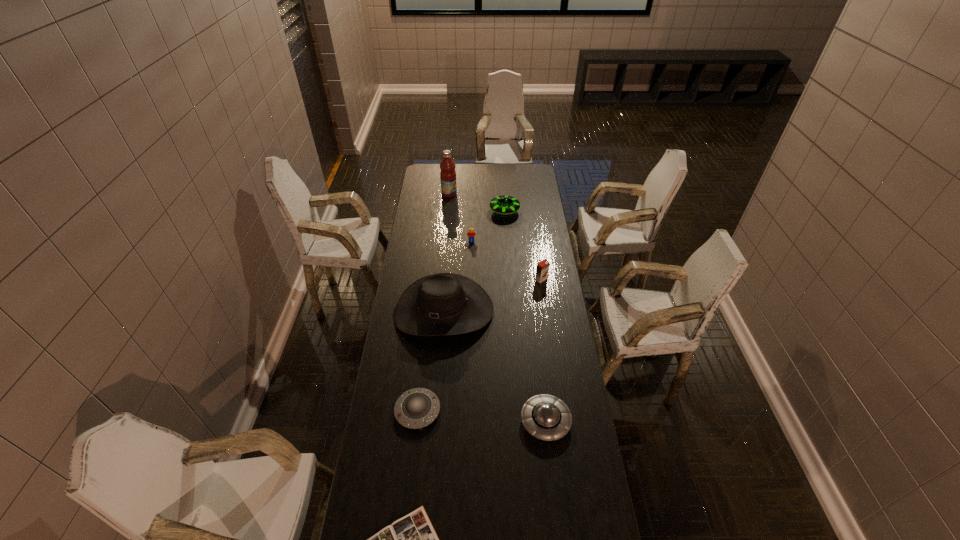
Image resolution: width=960 pixels, height=540 pixels. I want to click on the tallest object, so click(x=448, y=174).

This screenshot has height=540, width=960. I want to click on fruit juice, so click(x=448, y=174).

Where is `cowboy hat`? This screenshot has height=540, width=960. cowboy hat is located at coordinates (443, 304).

What are the coordinates of `the sixth shortest object` in the screenshot? It's located at (542, 269).

Find the location of a particular element. This screenshot has height=540, width=960. the second farthest object is located at coordinates (504, 204).

The height and width of the screenshot is (540, 960). I want to click on Lego, so click(x=471, y=233).

The height and width of the screenshot is (540, 960). Identify the location of the seventh tallest object. (416, 408).

This screenshot has height=540, width=960. I want to click on the leftmost saucer, so click(416, 408).

At what (x,y) coordinates should I click in order to perform the action: click on free space located 0.120m on the front label of the fruit juice. Please return your answer as a coordinate pair (x, y). Looking at the image, I should click on (477, 194).

Find the location of a particular element. The width and height of the screenshot is (960, 540). vacant space located 0.330m on the front-facing side of the cowboy hat is located at coordinates (435, 418).